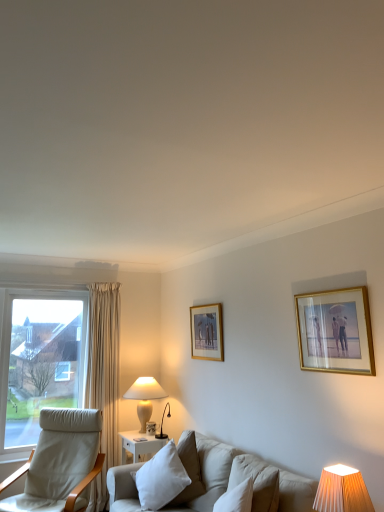
Question: From a real-world perspective, is white ceramic table lamp at lower left, placed as the 1th table lamp when sorted from left to right, above or below gold-framed picture at upper right, acting as the 2th picture frame starting from the back?

Choices:
 (A) above
 (B) below

Answer: (B)

Question: Is white ceramic table lamp at lower left, the 2th table lamp when ordered from right to left, taller or shorter than gold-framed picture at upper right, which is the 1th picture frame from right to left?

Choices:
 (A) tall
 (B) short

Answer: (B)

Question: Estimate the real-world distances between objects in this image. Which object is closer to the gold-framed picture at upper right, acting as the 2th picture frame starting from the back?

Choices:
 (A) white ceramic table lamp at lower left, the first table lamp in the back-to-front sequence
 (B) white soft cushion at center
 (C) orange pleated fabric lampshade at lower right, which ranks as the 1th table lamp in front-to-back order
 (D) light beige fabric chair at left
 (E) wooden picture frame at center, placed as the second picture frame when sorted from front to back

Answer: (C)

Question: Which object is positioned closest to the orange pleated fabric lampshade at lower right, which is the second table lamp from back to front?

Choices:
 (A) gold-framed picture at upper right, which is the 1th picture frame from right to left
 (B) white ceramic table lamp at lower left, the 2th table lamp viewed from the front
 (C) wooden picture frame at center, the second picture frame when ordered from right to left
 (D) white soft cushion at center
 (E) light beige fabric chair at left

Answer: (A)